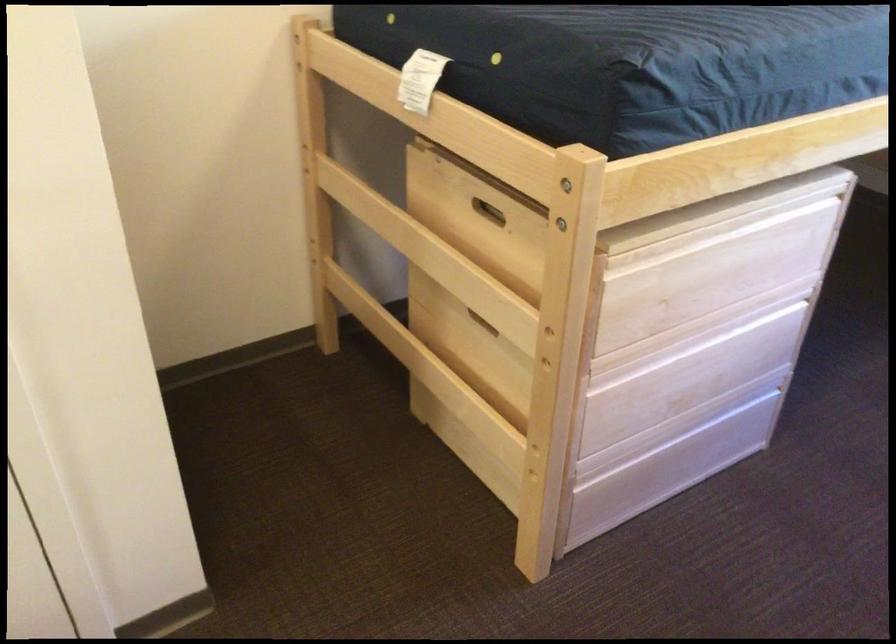
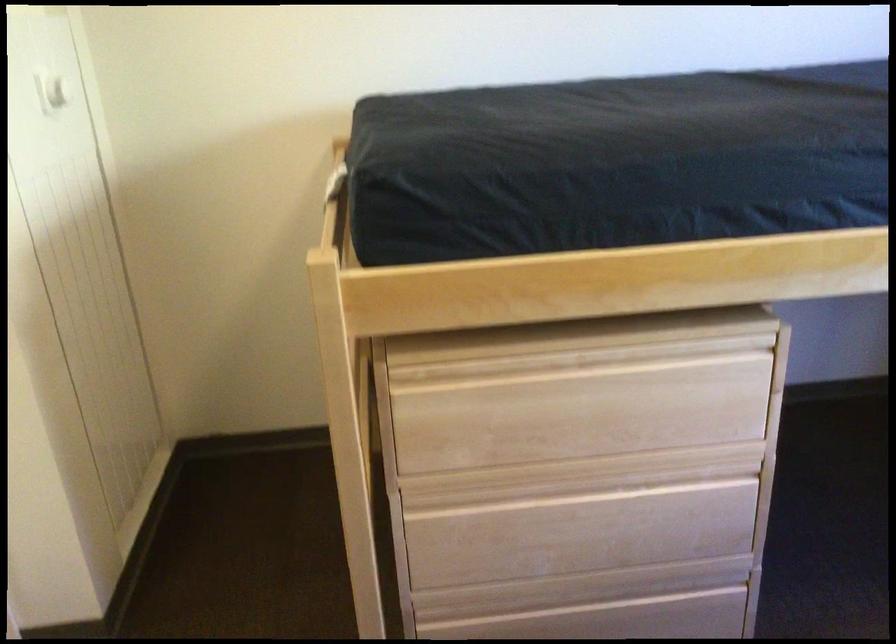
Find the pixel in the second image that matches (679,350) in the first image.

(546, 491)